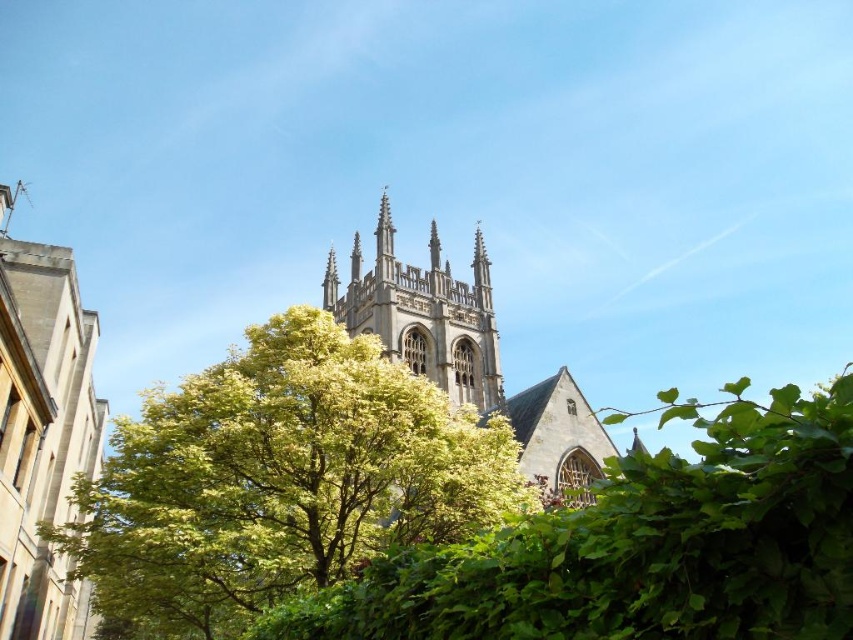
Looking at this image, does green leafy hedge at center appear over smooth stone spire at center?

Incorrect, green leafy hedge at center is not positioned above smooth stone spire at center.

This screenshot has height=640, width=853. Identify the location of green leafy hedge at center. (640, 547).

Which is behind, point (16, 308) or point (509, 416)?

The point (509, 416) is behind.

Is point (65, 508) more distant than point (479, 248)?

No.

Does point (20, 566) come closer to viewer compared to point (357, 241)?

Yes, point (20, 566) is closer to viewer.

Locate an element on the screen. The height and width of the screenshot is (640, 853). smooth stone church at left is located at coordinates coord(42,435).

Does green leafy hedge at center have a smaller size compared to stone gothic tower at center?

Actually, green leafy hedge at center might be larger than stone gothic tower at center.

Identify the location of green leafy hedge at center. (640, 547).

Which is behind, point (456, 566) or point (383, 211)?

The point (383, 211) is more distant.

Where is `green leafy hedge at center`? green leafy hedge at center is located at coordinates (640, 547).